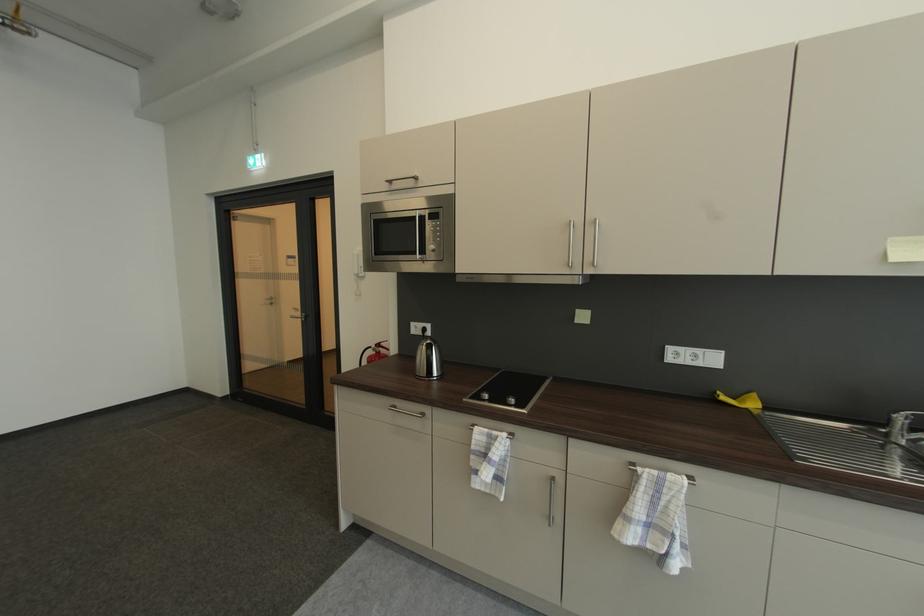
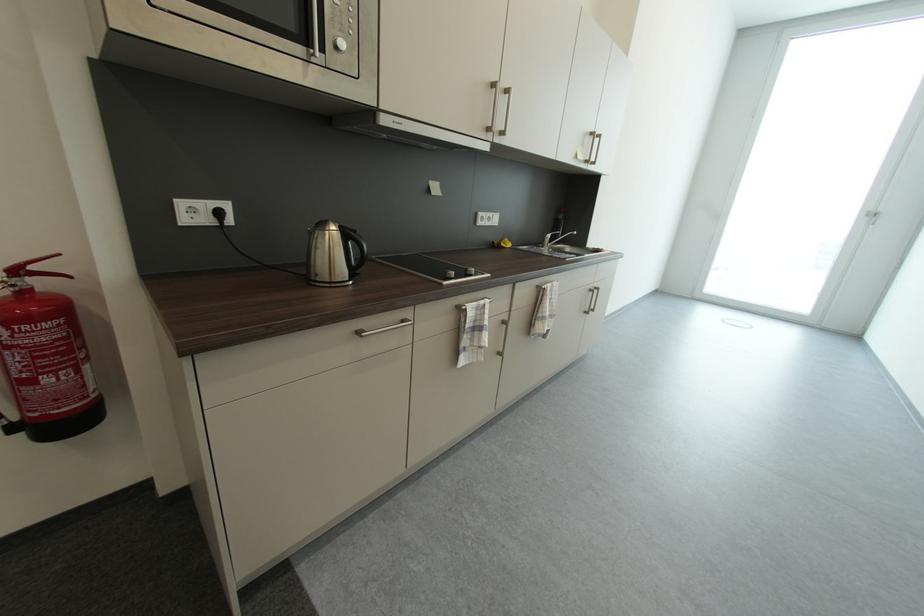
In the second image, find the point that corresponds to (x=492, y=398) in the first image.

(458, 275)